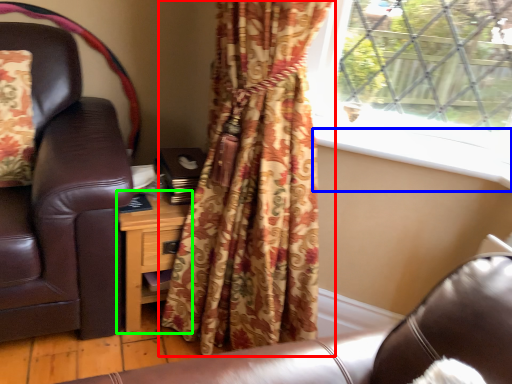
Question: Which is farther away from curtain (highlighted by a red box)? window sill (highlighted by a blue box) or nightstand (highlighted by a green box)?

Choices:
 (A) window sill
 (B) nightstand

Answer: (A)